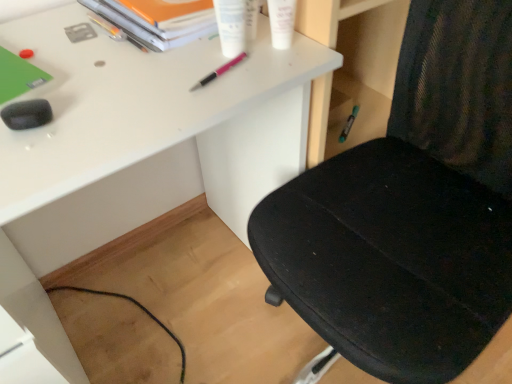
Find the location of `free location to the right of metallic silver pen at upper left, the fifth stationery positioned from the front`. free location to the right of metallic silver pen at upper left, the fifth stationery positioned from the front is located at coordinates (178, 39).